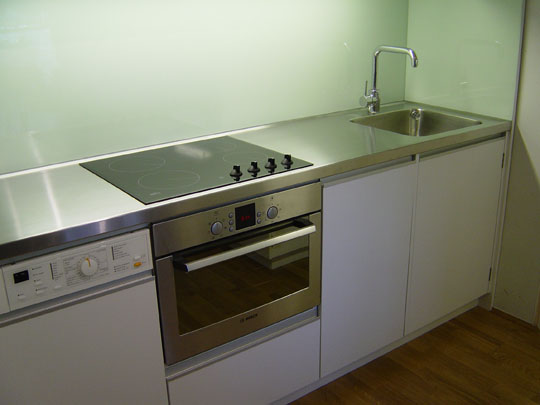
The image size is (540, 405). I want to click on dishwasher, so click(67, 271).